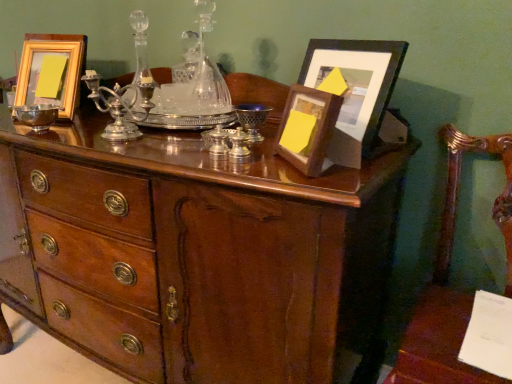
Question: Which direction should I rotate to look at silver polished candle holder at center, which appears as the first candle holder when viewed from the back?

Choices:
 (A) left
 (B) right

Answer: (A)

Question: From the image's perspective, is shiny silver bowl at left beneath matte black picture frame at upper right, which is the 1th picture frame from right to left?

Choices:
 (A) no
 (B) yes

Answer: (B)

Question: Is shiny silver bowl at left smaller than matte black picture frame at upper right, which is the 1th picture frame from right to left?

Choices:
 (A) yes
 (B) no

Answer: (A)

Question: From a real-world perspective, is shiny silver bowl at left below matte black picture frame at upper right, which is the 1th picture frame from right to left?

Choices:
 (A) no
 (B) yes

Answer: (B)

Question: Is shiny silver bowl at left behind matte black picture frame at upper right, the third picture frame viewed from the left?

Choices:
 (A) yes
 (B) no

Answer: (A)

Question: Does shiny silver bowl at left have a lesser width compared to matte black picture frame at upper right, the third picture frame viewed from the left?

Choices:
 (A) yes
 (B) no

Answer: (A)

Question: Considering the relative sizes of shiny silver bowl at left and matte black picture frame at upper right, the third picture frame viewed from the left, in the image provided, is shiny silver bowl at left shorter than matte black picture frame at upper right, the third picture frame viewed from the left,?

Choices:
 (A) yes
 (B) no

Answer: (A)

Question: Is wooden picture frame at upper right, which is the second picture frame from left to right, taller than gold wooden picture frame at upper left, the 3th picture frame in the right-to-left sequence?

Choices:
 (A) no
 (B) yes

Answer: (A)

Question: From a real-world perspective, does wooden picture frame at upper right, which is the 2th picture frame from right to left, sit lower than gold wooden picture frame at upper left, which appears as the 1th picture frame when viewed from the left?

Choices:
 (A) yes
 (B) no

Answer: (A)

Question: Does wooden picture frame at upper right, which is the 2th picture frame from right to left, lie behind gold wooden picture frame at upper left, the 3th picture frame in the right-to-left sequence?

Choices:
 (A) no
 (B) yes

Answer: (A)

Question: Is wooden picture frame at upper right, which is the second picture frame from left to right, to the left of gold wooden picture frame at upper left, the 3th picture frame in the right-to-left sequence, from the viewer's perspective?

Choices:
 (A) no
 (B) yes

Answer: (A)

Question: Considering the relative positions of wooden picture frame at upper right, which is the 2th picture frame from right to left, and gold wooden picture frame at upper left, the 3th picture frame in the right-to-left sequence, in the image provided, is wooden picture frame at upper right, which is the 2th picture frame from right to left, to the right of gold wooden picture frame at upper left, the 3th picture frame in the right-to-left sequence, from the viewer's perspective?

Choices:
 (A) no
 (B) yes

Answer: (B)

Question: From the image's perspective, is wooden picture frame at upper right, which is the 2th picture frame from right to left, under gold wooden picture frame at upper left, the 3th picture frame in the right-to-left sequence?

Choices:
 (A) no
 (B) yes

Answer: (B)

Question: Is silver metallic candle holder at center, the second candle holder positioned from the front, surrounded by gold wooden picture frame at upper left, which appears as the 1th picture frame when viewed from the left?

Choices:
 (A) no
 (B) yes

Answer: (A)